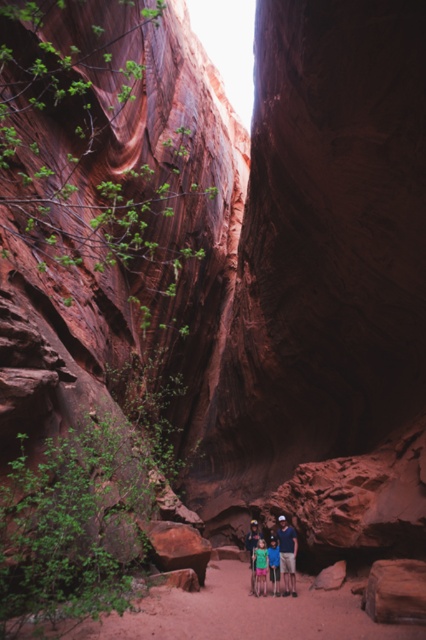
Question: Which point is farther to the camera?

Choices:
 (A) light blue denim shorts at center
 (B) green matte shirt at center
 (C) matte red family at center
 (D) blue denim jeans at center

Answer: (A)

Question: Estimate the real-world distances between objects in this image. Which object is closer to the matte red family at center?

Choices:
 (A) blue denim jeans at center
 (B) green matte shirt at center

Answer: (A)

Question: Does matte red family at center have a smaller size compared to light blue denim shorts at center?

Choices:
 (A) yes
 (B) no

Answer: (B)

Question: Does matte red family at center have a smaller size compared to blue denim jeans at center?

Choices:
 (A) yes
 (B) no

Answer: (B)

Question: Among these objects, which one is farthest from the camera?

Choices:
 (A) green matte shirt at center
 (B) matte red family at center
 (C) light blue denim shorts at center

Answer: (C)

Question: Is green matte shirt at center thinner than light blue denim shorts at center?

Choices:
 (A) yes
 (B) no

Answer: (B)